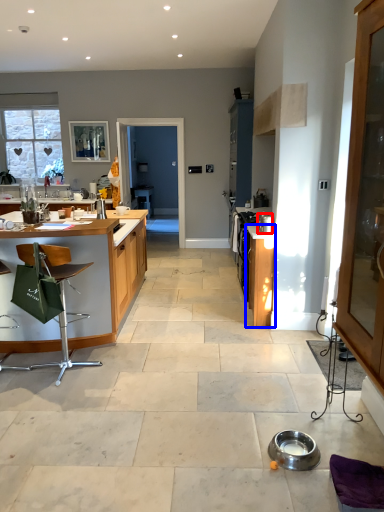
Question: Which object appears farthest to the camera in this image, appliance (highlighted by a red box) or cabinetry (highlighted by a blue box)?

Choices:
 (A) appliance
 (B) cabinetry

Answer: (B)